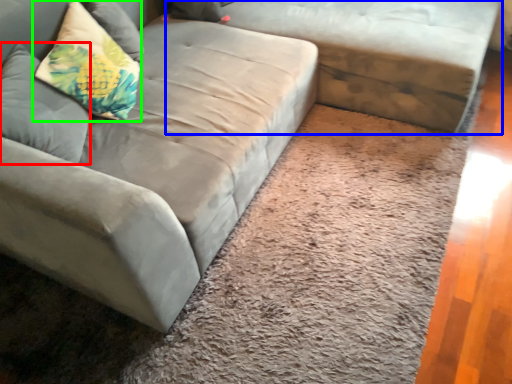
Question: Based on their relative distances, which object is nearer to pillow (highlighted by a red box)? Choose from studio couch (highlighted by a blue box) and pillow (highlighted by a green box).

Choices:
 (A) studio couch
 (B) pillow

Answer: (B)